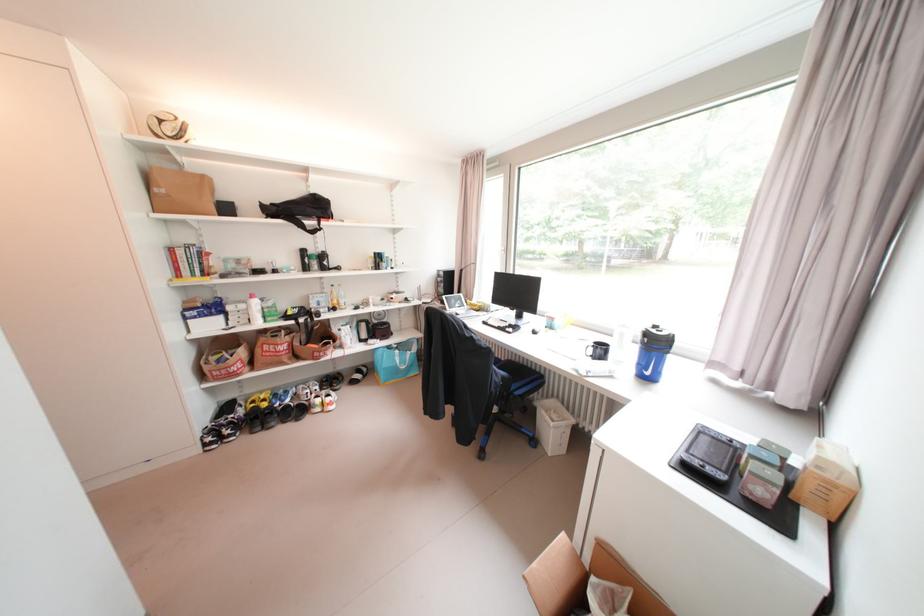
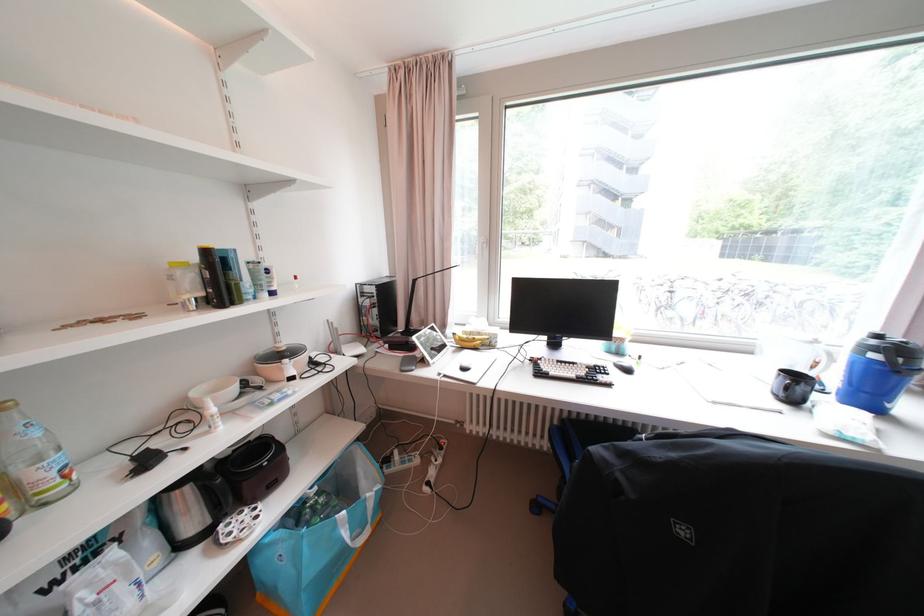
The point at (654, 341) is marked in the first image. Where is the corresponding point in the second image?

(909, 361)